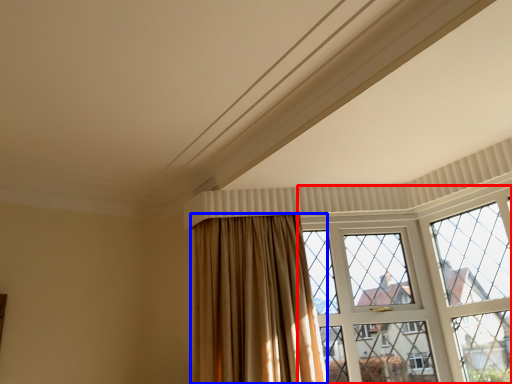
Question: Among these objects, which one is farthest to the camera, window (highlighted by a red box) or curtain (highlighted by a blue box)?

Choices:
 (A) window
 (B) curtain

Answer: (A)